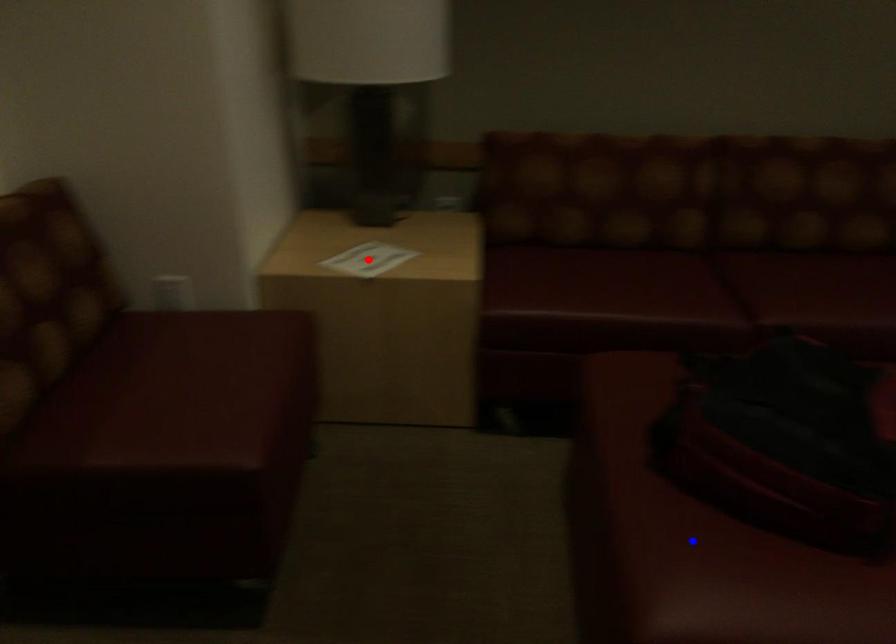
Question: Which of the two points in the image is closer to the camera?

Choices:
 (A) Blue point is closer.
 (B) Red point is closer.

Answer: (A)